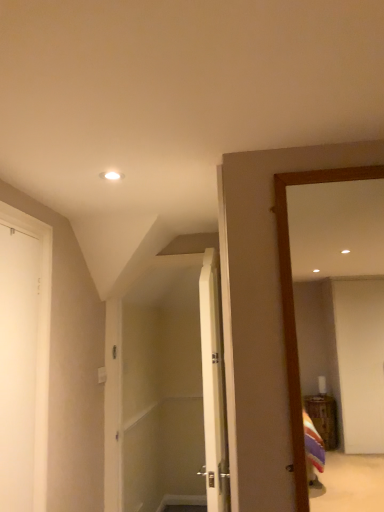
Question: Can you confirm if white matte door at left, positioned as the 2th door in right-to-left order, is positioned to the left of wooden mirror at right?

Choices:
 (A) no
 (B) yes

Answer: (B)

Question: Does white matte door at left, which is the 1th door from front to back, come behind wooden mirror at right?

Choices:
 (A) no
 (B) yes

Answer: (B)

Question: Could wooden mirror at right be considered to be inside white matte door at left, which is the 1th door from front to back?

Choices:
 (A) no
 (B) yes

Answer: (A)

Question: Is white matte door at left, the 1th door viewed from the left, located outside wooden mirror at right?

Choices:
 (A) no
 (B) yes

Answer: (B)

Question: From the image's perspective, is white matte door at left, positioned as the 2th door in right-to-left order, under wooden mirror at right?

Choices:
 (A) no
 (B) yes

Answer: (B)

Question: Can you confirm if white matte door at left, which is the 1th door from front to back, is thinner than wooden mirror at right?

Choices:
 (A) no
 (B) yes

Answer: (B)

Question: Is wooden mirror at right to the right of white wood door at center, positioned as the second door in left-to-right order, from the viewer's perspective?

Choices:
 (A) no
 (B) yes

Answer: (B)

Question: Is wooden mirror at right looking in the opposite direction of white wood door at center, which is the first door in back-to-front order?

Choices:
 (A) yes
 (B) no

Answer: (B)

Question: Considering the relative sizes of wooden mirror at right and white wood door at center, the 1th door from the right, in the image provided, is wooden mirror at right shorter than white wood door at center, the 1th door from the right,?

Choices:
 (A) yes
 (B) no

Answer: (A)

Question: Does wooden mirror at right come in front of white wood door at center, which is the 2th door from front to back?

Choices:
 (A) yes
 (B) no

Answer: (A)

Question: Is wooden mirror at right far from white wood door at center, positioned as the second door in left-to-right order?

Choices:
 (A) yes
 (B) no

Answer: (B)

Question: Is wooden mirror at right thinner than white wood door at center, which is the 2th door from front to back?

Choices:
 (A) yes
 (B) no

Answer: (A)

Question: Is the surface of wooden mirror at right in direct contact with white matte door at left, which is the 1th door from front to back?

Choices:
 (A) no
 (B) yes

Answer: (A)